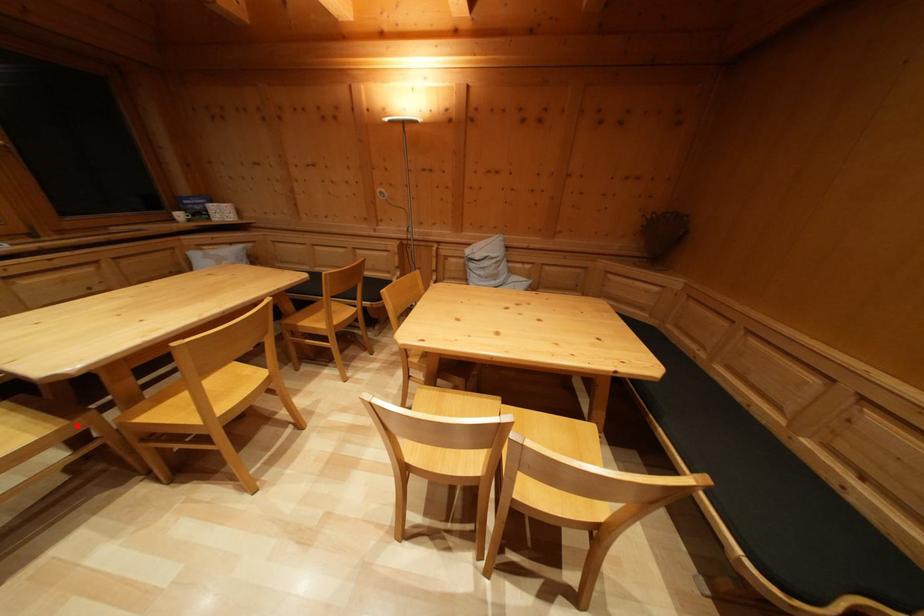
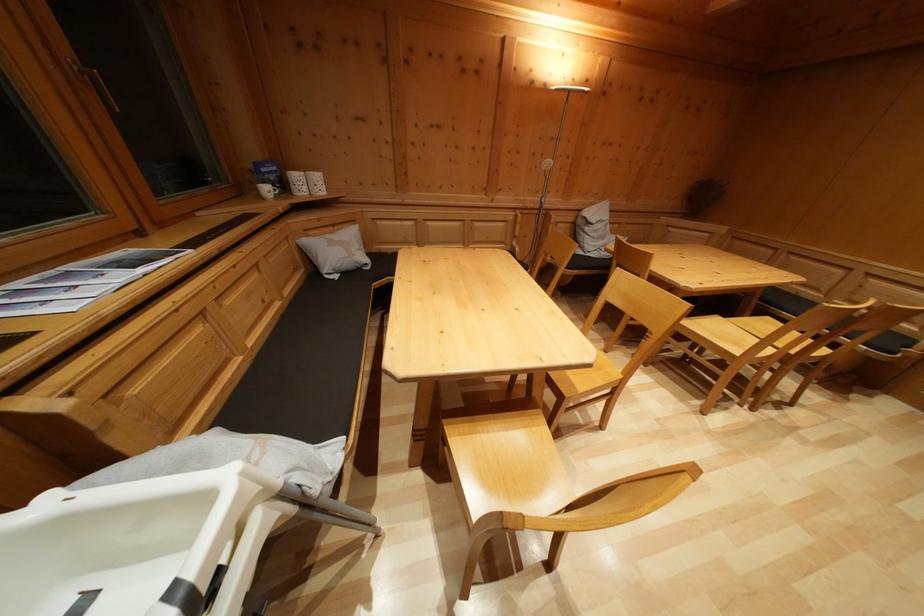
Where in the second image is the point corresponding to the highlighted location from the first image?

(541, 415)